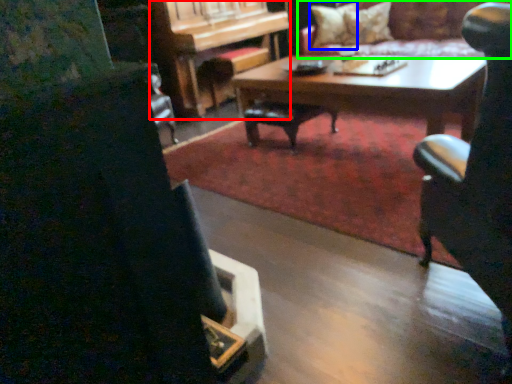
Question: Based on their relative distances, which object is farther from piano (highlighted by a red box)? Choose from pillow (highlighted by a blue box) and couch (highlighted by a green box).

Choices:
 (A) pillow
 (B) couch

Answer: (B)